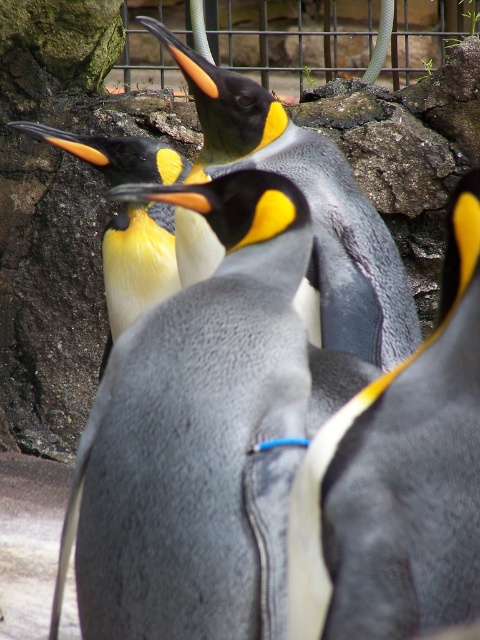
What do you see at coordinates (202, 433) in the screenshot? The height and width of the screenshot is (640, 480). I see `gray matte penguin at center` at bounding box center [202, 433].

Does point (290, 353) come in front of point (173, 164)?

Yes, it is.

Locate an element on the screen. gray matte penguin at center is located at coordinates 202,433.

Who is lower down, smooth gray penguin at center or black glossy penguin at center?

smooth gray penguin at center is lower down.

Can you confirm if smooth gray penguin at center is shorter than black glossy penguin at center?

Yes, smooth gray penguin at center is shorter than black glossy penguin at center.

Locate an element on the screen. This screenshot has height=640, width=480. smooth gray penguin at center is located at coordinates (398, 480).

Can you confirm if smooth gray penguin at center is bigger than matte black penguin at center?

Incorrect, smooth gray penguin at center is not larger than matte black penguin at center.

Does smooth gray penguin at center appear on the left side of matte black penguin at center?

No, smooth gray penguin at center is not to the left of matte black penguin at center.

At what (x,y) coordinates should I click in order to perform the action: click on smooth gray penguin at center. Please return your answer as a coordinate pair (x, y). This screenshot has width=480, height=640. Looking at the image, I should click on click(398, 480).